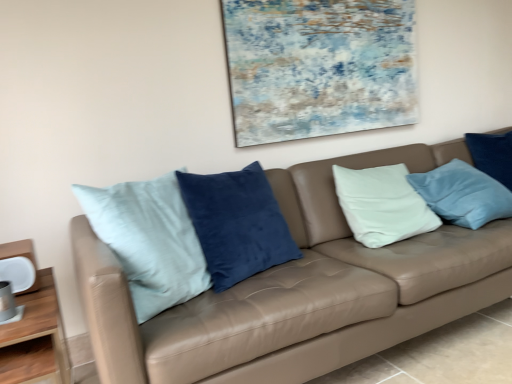
Question: Considering the relative sizes of leather couch at center and wooden table at lower left in the image provided, is leather couch at center bigger than wooden table at lower left?

Choices:
 (A) no
 (B) yes

Answer: (B)

Question: Is wooden table at lower left surrounded by leather couch at center?

Choices:
 (A) no
 (B) yes

Answer: (A)

Question: Is leather couch at center at the right side of wooden table at lower left?

Choices:
 (A) yes
 (B) no

Answer: (A)

Question: Does leather couch at center have a lesser height compared to wooden table at lower left?

Choices:
 (A) no
 (B) yes

Answer: (A)

Question: Is leather couch at center looking in the opposite direction of wooden table at lower left?

Choices:
 (A) no
 (B) yes

Answer: (A)

Question: Considering the positions of wooden table at lower left and textured canvas painting at upper center in the image, is wooden table at lower left wider or thinner than textured canvas painting at upper center?

Choices:
 (A) wide
 (B) thin

Answer: (A)

Question: Relative to textured canvas painting at upper center, is wooden table at lower left in front or behind?

Choices:
 (A) behind
 (B) front

Answer: (B)

Question: Considering the positions of wooden table at lower left and textured canvas painting at upper center in the image, is wooden table at lower left taller or shorter than textured canvas painting at upper center?

Choices:
 (A) short
 (B) tall

Answer: (A)

Question: Which is correct: wooden table at lower left is inside textured canvas painting at upper center, or outside of it?

Choices:
 (A) inside
 (B) outside

Answer: (B)

Question: Considering the positions of textured canvas painting at upper center and wooden table at lower left in the image, is textured canvas painting at upper center wider or thinner than wooden table at lower left?

Choices:
 (A) thin
 (B) wide

Answer: (A)

Question: From a real-world perspective, is textured canvas painting at upper center positioned above or below wooden table at lower left?

Choices:
 (A) above
 (B) below

Answer: (A)

Question: In terms of height, does textured canvas painting at upper center look taller or shorter compared to wooden table at lower left?

Choices:
 (A) short
 (B) tall

Answer: (B)

Question: From the image's perspective, is textured canvas painting at upper center located above or below wooden table at lower left?

Choices:
 (A) below
 (B) above

Answer: (B)

Question: From a real-world perspective, relative to textured canvas painting at upper center, is leather couch at center vertically above or below?

Choices:
 (A) above
 (B) below

Answer: (B)

Question: Relative to textured canvas painting at upper center, is leather couch at center in front or behind?

Choices:
 (A) front
 (B) behind

Answer: (A)